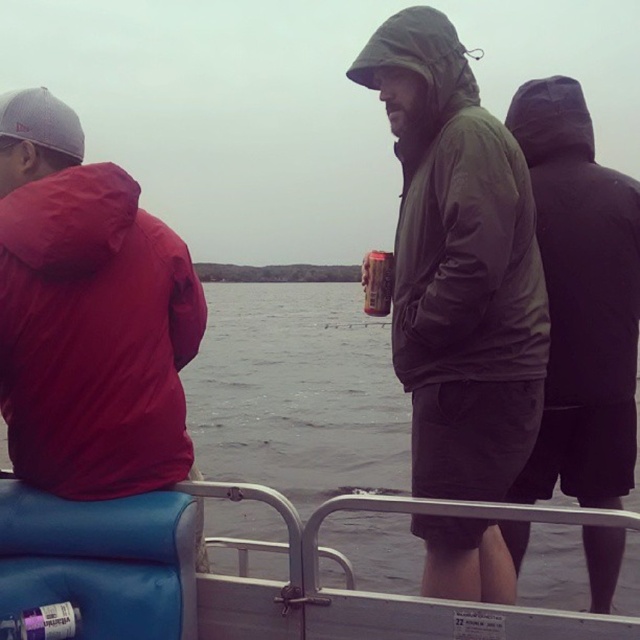
You are a photographer trying to capture the scene on the boat. You notice the matte green jacket at center and the gray water at center. Which object appears narrower in the photo?

The matte green jacket at center has a lesser width compared to the gray water at center, so it appears narrower in the photo.

You are standing on the boat and want to hand a life jacket to the person wearing the matte green jacket at center. If you can reach 1.8 meters, will you be able to reach them without moving?

The matte green jacket at center and viewer are 1.82 meters apart from each other. Since your reach is 1.8 meters, you cannot quite reach them without moving closer.

You are a photographer trying to capture a clear shot of the metallic can at center without the blue vinyl seat at lower left blocking it. Given their heights, is this possible?

The blue vinyl seat at lower left is taller than the metallic can at center, so it might block the view. To avoid obstruction, position yourself lower or move the camera angle downward to ensure the can is visible below the seat.